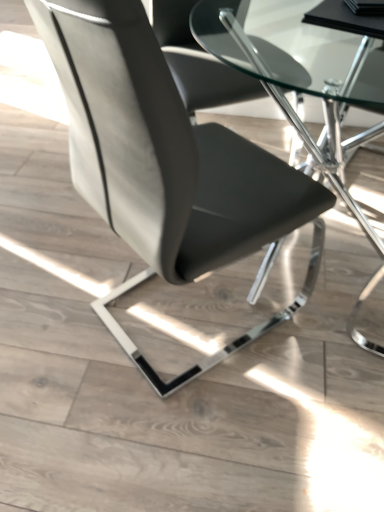
The height and width of the screenshot is (512, 384). Describe the element at coordinates (305, 69) in the screenshot. I see `transparent glass table at center` at that location.

Locate an element on the screen. The height and width of the screenshot is (512, 384). transparent glass table at center is located at coordinates (305, 69).

Looking at this image, what is the approximate width of transparent glass table at center?

The width of transparent glass table at center is 93.32 centimeters.

The image size is (384, 512). What do you see at coordinates (165, 163) in the screenshot?
I see `matte black chair at center` at bounding box center [165, 163].

Measure the distance between point (85, 181) and camera.

Point (85, 181) is 38.03 inches away from camera.

Where is `matte black chair at center`? The height and width of the screenshot is (512, 384). matte black chair at center is located at coordinates (165, 163).

Find the location of a particular element. transparent glass table at center is located at coordinates (305, 69).

Between matte black chair at center and transparent glass table at center, which one appears on the right side from the viewer's perspective?

transparent glass table at center is more to the right.

Is matte black chair at center in front of or behind transparent glass table at center in the image?

In the image, matte black chair at center appears in front of transparent glass table at center.

Between point (100, 83) and point (331, 91), which one is positioned in front?

The point (100, 83) is closer to the camera.

From the image's perspective, between matte black chair at center and transparent glass table at center, which one is located above?

transparent glass table at center.

From a real-world perspective, which object rests below the other?

transparent glass table at center is physically lower.

Can you confirm if matte black chair at center is wider than transparent glass table at center?

No, matte black chair at center is not wider than transparent glass table at center.

Is matte black chair at center taller or shorter than transparent glass table at center?

In the image, matte black chair at center appears to be taller than transparent glass table at center.

Does matte black chair at center have a smaller size compared to transparent glass table at center?

Indeed, matte black chair at center has a smaller size compared to transparent glass table at center.

Does matte black chair at center contain transparent glass table at center?

No, transparent glass table at center is not inside matte black chair at center.

Based on the photo, is matte black chair at center far away from transparent glass table at center?

No, matte black chair at center is in close proximity to transparent glass table at center.

Is matte black chair at center turned away from transparent glass table at center?

Absolutely, matte black chair at center is directed away from transparent glass table at center.

Can you tell me how much matte black chair at center and transparent glass table at center differ in facing direction?

They differ by 139 degrees in their facing directions.

In the image, there is a transparent glass table at center. At what (x,y) coordinates should I click in order to perform the action: click on chair below it (from the image's perspective). Please return your answer as a coordinate pair (x, y). Looking at the image, I should click on (165, 163).

Considering the positions of objects transparent glass table at center and matte black chair at center in the image provided, who is more to the right, transparent glass table at center or matte black chair at center?

transparent glass table at center is more to the right.

Based on the photo, considering their positions, is transparent glass table at center located in front of or behind matte black chair at center?

Visually, transparent glass table at center is located behind matte black chair at center.

Does point (299, 126) lie behind point (200, 152)?

Yes, point (299, 126) is behind point (200, 152).

From the image's perspective, would you say transparent glass table at center is shown under matte black chair at center?

No, from the image's perspective, transparent glass table at center is not beneath matte black chair at center.

From a real-world perspective, is transparent glass table at center physically located above or below matte black chair at center?

In terms of real-world spatial position, transparent glass table at center is below matte black chair at center.

Considering the relative sizes of transparent glass table at center and matte black chair at center in the image provided, is transparent glass table at center thinner than matte black chair at center?

In fact, transparent glass table at center might be wider than matte black chair at center.

Considering the sizes of transparent glass table at center and matte black chair at center in the image, is transparent glass table at center taller or shorter than matte black chair at center?

In the image, transparent glass table at center appears to be shorter than matte black chair at center.

Who is smaller, transparent glass table at center or matte black chair at center?

matte black chair at center is smaller.

Consider the image. Is transparent glass table at center inside the boundaries of matte black chair at center, or outside?

transparent glass table at center is not enclosed by matte black chair at center.

Is transparent glass table at center not close to matte black chair at center?

No, transparent glass table at center is not far from matte black chair at center.

Is transparent glass table at center oriented towards matte black chair at center?

Yes, transparent glass table at center is oriented towards matte black chair at center.

What's the angular difference between transparent glass table at center and matte black chair at center's facing directions?

The angular difference between transparent glass table at center and matte black chair at center is 139 degrees.

Measure the distance from transparent glass table at center to matte black chair at center.

transparent glass table at center is 26.01 inches away from matte black chair at center.

Find the location of a particular element. The height and width of the screenshot is (512, 384). table lying behind the matte black chair at center is located at coordinates (305, 69).

Find the location of `chair below the transparent glass table at center (from the image's perspective)`. chair below the transparent glass table at center (from the image's perspective) is located at coordinates (165, 163).

Find the location of a particular element. This screenshot has height=512, width=384. table located on the right of matte black chair at center is located at coordinates (305, 69).